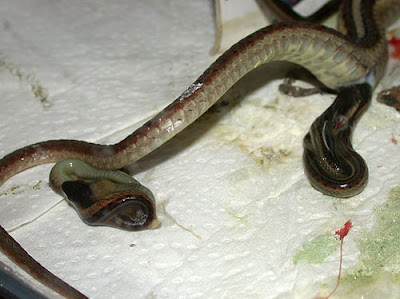
Where is `absorbable mat`? The height and width of the screenshot is (299, 400). absorbable mat is located at coordinates (210, 200).